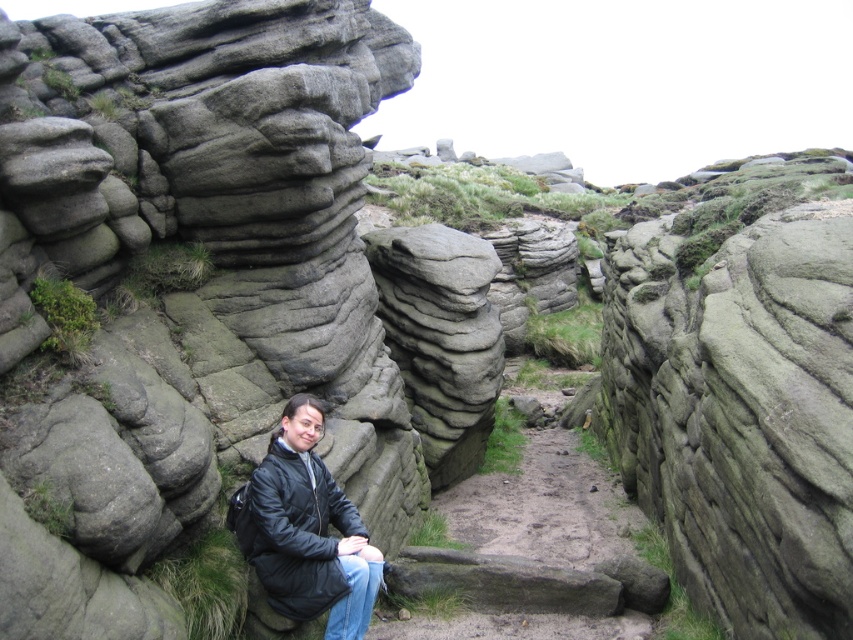
Question: Is the position of dull gray stone path at center more distant than that of black matte jacket at center?

Choices:
 (A) no
 (B) yes

Answer: (B)

Question: Which object appears closest to the camera in this image?

Choices:
 (A) black matte jacket at center
 (B) dull gray stone path at center

Answer: (A)

Question: Which point is closer to the camera?

Choices:
 (A) click(660, 609)
 (B) click(299, 408)

Answer: (B)

Question: Is dull gray stone path at center above black matte jacket at center?

Choices:
 (A) no
 (B) yes

Answer: (A)

Question: Which point is closer to the camera taking this photo?

Choices:
 (A) (294, 451)
 (B) (491, 532)

Answer: (A)

Question: Is dull gray stone path at center positioned in front of black matte jacket at center?

Choices:
 (A) no
 (B) yes

Answer: (A)